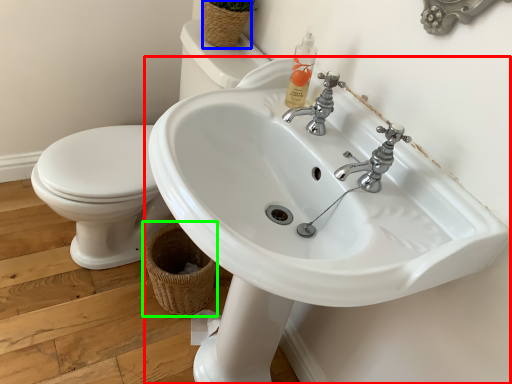
Question: Which object is positioned closest to sink (highlighted by a red box)? Select from basket (highlighted by a blue box) and basket (highlighted by a green box).

Choices:
 (A) basket
 (B) basket

Answer: (B)